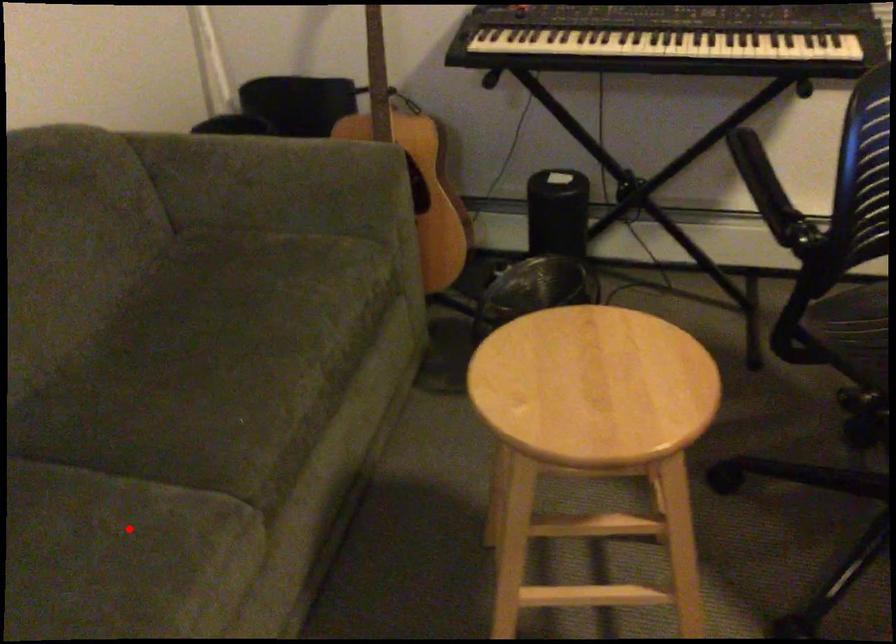
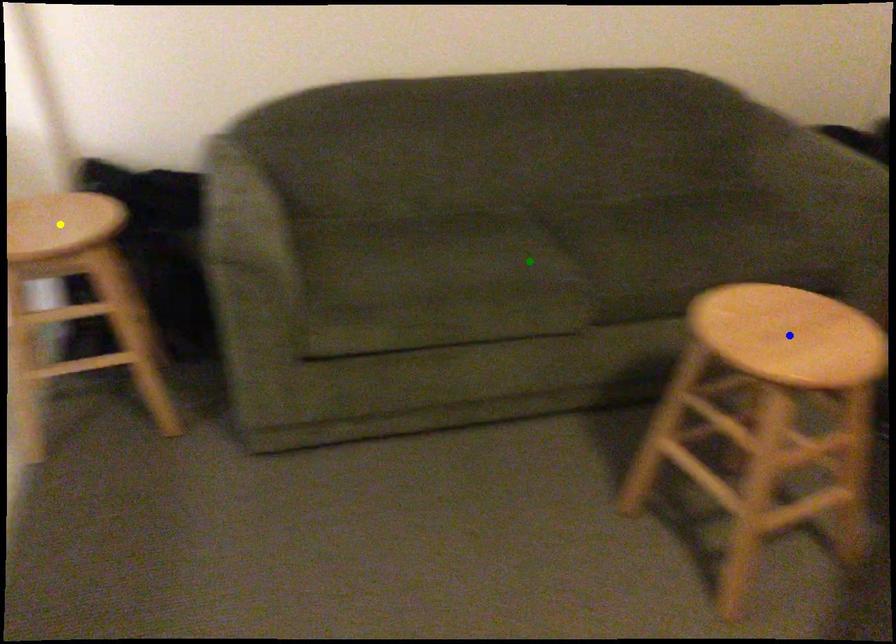
Question: I am providing you with two images of the same scene from different viewpoints. A red point is marked on the first image. You are given multiple points on the second image. Which mark in image 2 goes with the point in image 1?

Choices:
 (A) blue point
 (B) yellow point
 (C) green point

Answer: (C)